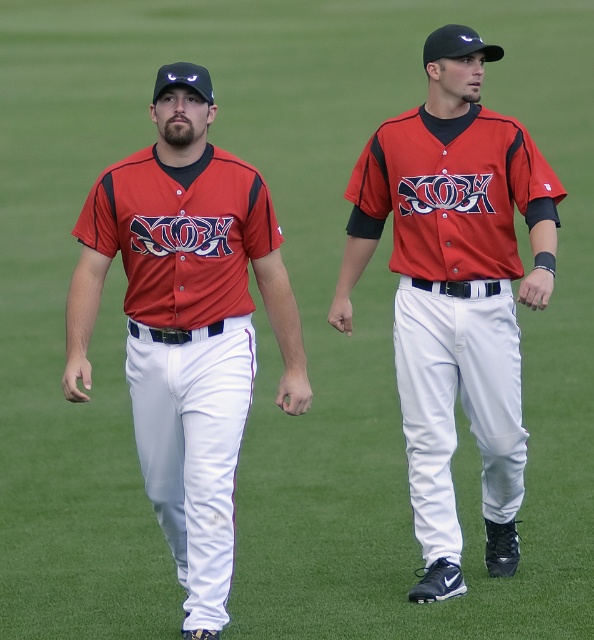
Question: Does matte red baseball uniform at center come behind matte jersey at center?

Choices:
 (A) yes
 (B) no

Answer: (B)

Question: Does matte red baseball uniform at center have a smaller size compared to matte jersey at center?

Choices:
 (A) no
 (B) yes

Answer: (B)

Question: Which point is farther to the camera?

Choices:
 (A) matte jersey at center
 (B) matte red baseball uniform at center

Answer: (A)

Question: Where is matte red baseball uniform at center located in relation to matte jersey at center in the image?

Choices:
 (A) above
 (B) below

Answer: (B)